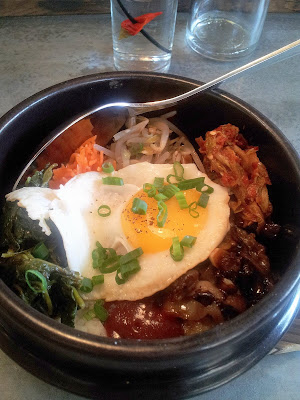
This screenshot has height=400, width=300. I want to click on metal sppon, so click(x=100, y=125).